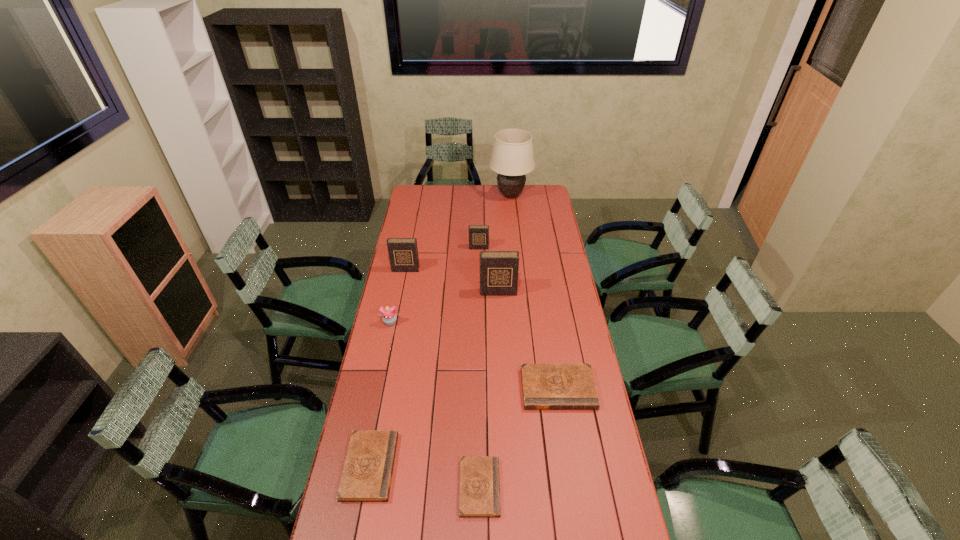
Image resolution: width=960 pixels, height=540 pixels. In order to click on free point that satisfies the following two spatial constraints: 1. on the front cover of the nearest dark diary; 2. on the spine side of the fifth tallest diary in this screenshot , I will do `click(506, 466)`.

Identify the location of blank space that satisfies the following two spatial constraints: 1. on the front cover of the nearest dark diary; 2. on the spine side of the smallest brown diary. (507, 487).

Image resolution: width=960 pixels, height=540 pixels. I want to click on vacant space that satisfies the following two spatial constraints: 1. on the front cover of the seventh shortest object; 2. on the spine side of the shortest diary, so click(x=507, y=487).